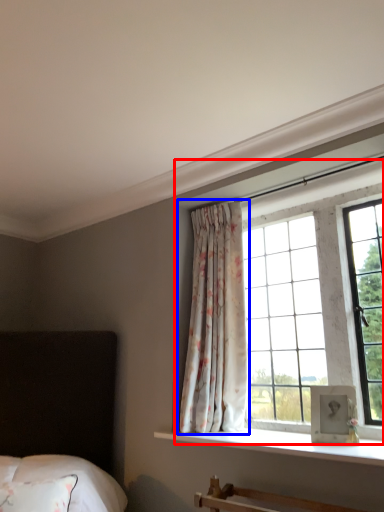
Question: Which of the following is the closest to the observer, bay window (highlighted by a red box) or curtain (highlighted by a blue box)?

Choices:
 (A) bay window
 (B) curtain

Answer: (A)